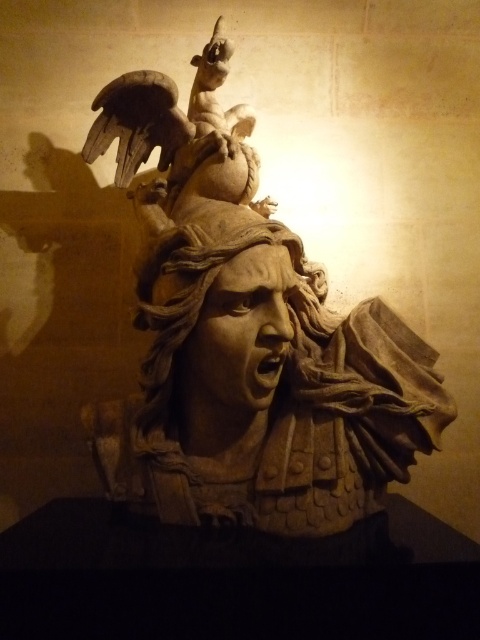
You are an art conservator examining the sculpture. You need to determine if a 2m tall protective cover will fit over the stone sculpture at center and the carved stone head at center. Based on their sizes, will the cover accommodate both?

The stone sculpture at center is much taller than the carved stone head at center. Since the cover is 2m tall, it depends on the actual height of the sculpture. If the sculpture is under 2m, then yes, but if it exceeds 2m, it won

You are an art conservator standing at the entrance of the gallery. You need to place a protective barrier around the stone sculpture at center. What are the coordinates where you should position the barrier?

The stone sculpture at center is located at coordinates point (245, 339), so the protective barrier should be positioned around those coordinates to ensure proper coverage.